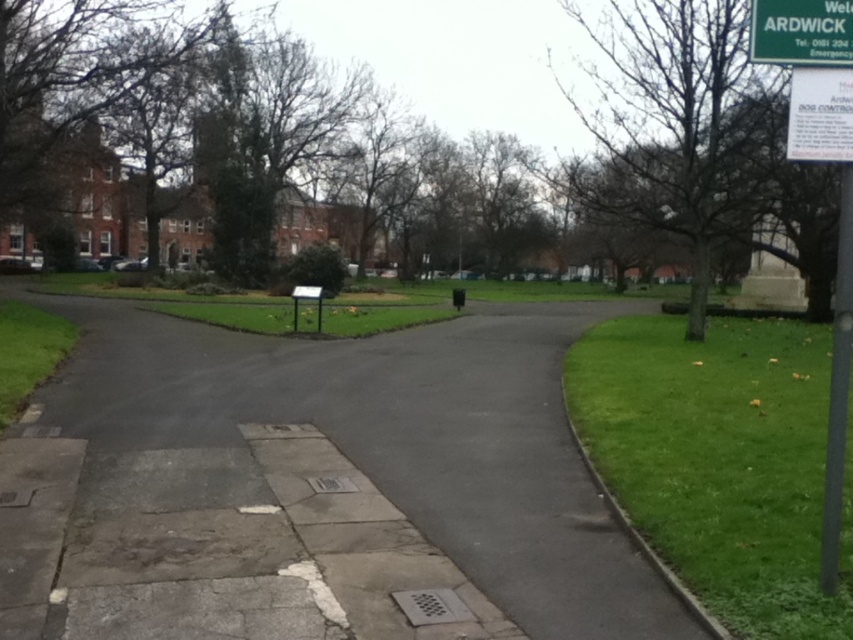
Which is behind, point (834, 380) or point (10, 340)?

Point (10, 340)

Is point (845, 166) closer to camera compared to point (47, 317)?

Yes, point (845, 166) is in front of point (47, 317).

Find the location of a particular element. black metal pole at right is located at coordinates (838, 388).

Who is taller, black metal pole at right or green plastic sign at upper right?

Standing taller between the two is black metal pole at right.

Can you confirm if black metal pole at right is taller than green plastic sign at upper right?

Correct, black metal pole at right is much taller as green plastic sign at upper right.

Between point (840, 278) and point (798, 4), which one is positioned in front?

Positioned in front is point (798, 4).

Where is `black metal pole at right`? black metal pole at right is located at coordinates point(838,388).

Is gray concrete pavement at center shorter than green plastic sign at upper right?

Incorrect, gray concrete pavement at center's height does not fall short of green plastic sign at upper right's.

Can you confirm if gray concrete pavement at center is positioned to the left of green plastic sign at upper right?

Correct, you'll find gray concrete pavement at center to the left of green plastic sign at upper right.

What do you see at coordinates (312, 486) in the screenshot? I see `gray concrete pavement at center` at bounding box center [312, 486].

The height and width of the screenshot is (640, 853). I want to click on gray concrete pavement at center, so pos(312,486).